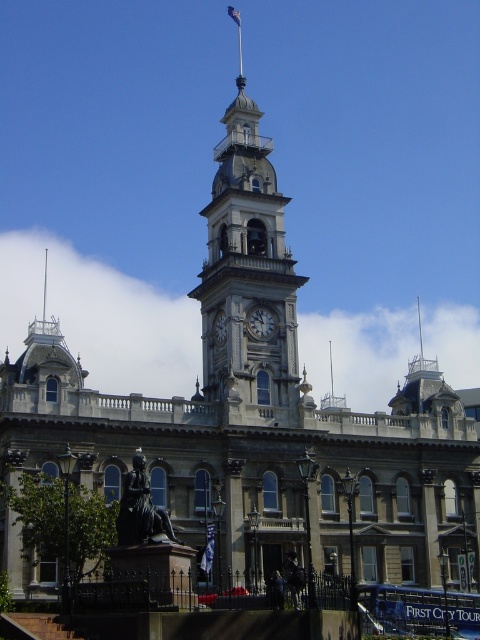
You are standing in front of the historic building and notice two points marked on the clock tower. One is at coordinate point (x=214, y=529) and the other at point (x=240, y=24). Which point is nearer to you?

Point (x=214, y=529) is closer to the viewer than point (x=240, y=24).

You are standing in front of the grand historic building and want to take a photo of both the polished brass clock tower at center and the white glossy clock at center. Which one will appear larger in your photo?

The polished brass clock tower at center will appear larger in the photo because it is closer to the viewer than the white glossy clock at center.